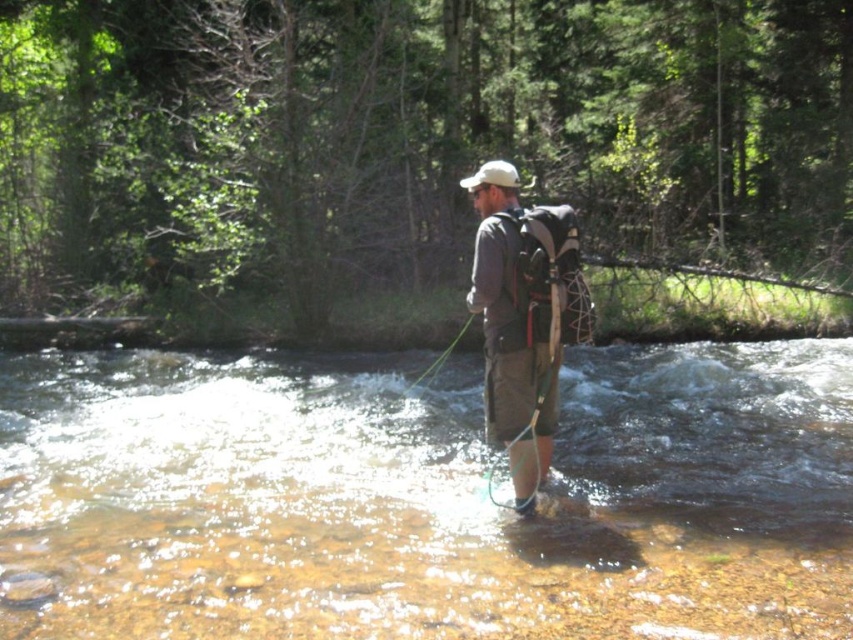
Question: Does clear water at center have a greater width compared to gray fabric backpack at center?

Choices:
 (A) yes
 (B) no

Answer: (A)

Question: Can you confirm if clear water at center is positioned below gray fabric backpack at center?

Choices:
 (A) no
 (B) yes

Answer: (B)

Question: Which point is closer to the camera?

Choices:
 (A) (355, 374)
 (B) (556, 300)

Answer: (B)

Question: Among these objects, which one is nearest to the camera?

Choices:
 (A) clear water at center
 (B) gray fabric backpack at center

Answer: (A)

Question: Does clear water at center have a greater width compared to gray fabric backpack at center?

Choices:
 (A) yes
 (B) no

Answer: (A)